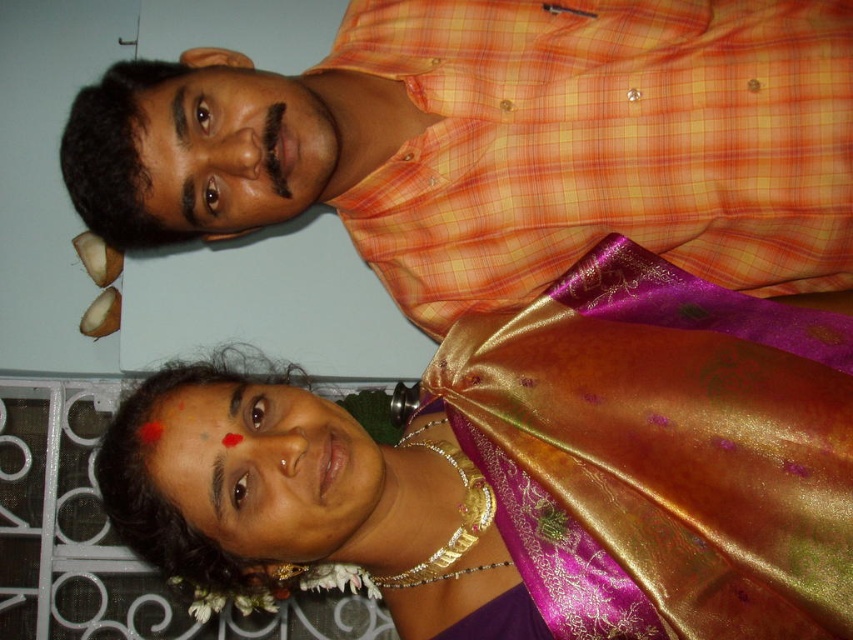
Question: Which object appears farthest from the camera in this image?

Choices:
 (A) orange checkered shirt at upper center
 (B) shiny silk saree at center

Answer: (A)

Question: Can you confirm if shiny silk saree at center is smaller than orange checkered shirt at upper center?

Choices:
 (A) no
 (B) yes

Answer: (A)

Question: Which point is closer to the camera?

Choices:
 (A) orange checkered shirt at upper center
 (B) shiny silk saree at center

Answer: (B)

Question: Can you confirm if shiny silk saree at center is positioned above orange checkered shirt at upper center?

Choices:
 (A) no
 (B) yes

Answer: (A)

Question: Does shiny silk saree at center have a greater width compared to orange checkered shirt at upper center?

Choices:
 (A) no
 (B) yes

Answer: (B)